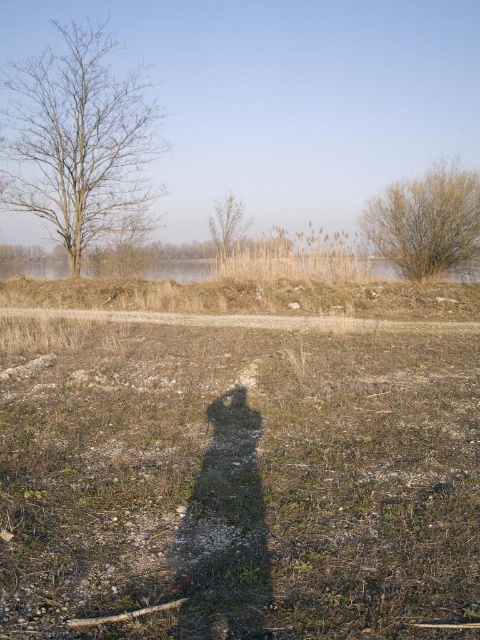
Question: Which object appears closest to the camera in this image?

Choices:
 (A) brown gravelly dirt field at center
 (B) bare wood tree at center
 (C) green leafy bush at upper right
 (D) bare wood tree at upper left

Answer: (A)

Question: Estimate the real-world distances between objects in this image. Which object is farther from the bare wood tree at center?

Choices:
 (A) green leafy bush at upper right
 (B) bare wood tree at upper left
 (C) brown gravelly dirt field at center

Answer: (C)

Question: Estimate the real-world distances between objects in this image. Which object is closer to the brown gravelly dirt field at center?

Choices:
 (A) green leafy bush at upper right
 (B) bare wood tree at center

Answer: (B)

Question: Is bare wood tree at upper left bigger than green leafy bush at upper right?

Choices:
 (A) no
 (B) yes

Answer: (B)

Question: Does brown gravelly dirt field at center have a larger size compared to green leafy bush at upper right?

Choices:
 (A) yes
 (B) no

Answer: (A)

Question: Is brown gravelly dirt field at center wider than green leafy bush at upper right?

Choices:
 (A) yes
 (B) no

Answer: (A)